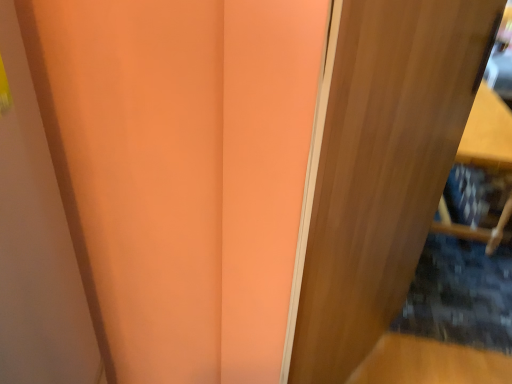
I want to click on wooden shelf at right, so click(x=487, y=131).

Describe the element at coordinates (487, 131) in the screenshot. I see `wooden shelf at right` at that location.

Measure the distance between wooden shelf at right and camera.

6.02 feet.

Describe the element at coordinates (387, 190) in the screenshot. Image resolution: width=512 pixels, height=384 pixels. I see `wooden door at right` at that location.

The image size is (512, 384). In order to click on wooden door at right in this screenshot , I will do `click(387, 190)`.

Identify the location of wooden shelf at right. This screenshot has height=384, width=512. (487, 131).

Is wooden shelf at right to the left or to the right of wooden door at right in the image?

In the image, wooden shelf at right appears on the right side of wooden door at right.

Is wooden shelf at right positioned before wooden door at right?

No, wooden shelf at right is behind wooden door at right.

Which point is more forward, (466, 236) or (401, 111)?

The point (401, 111) is more forward.

From the image's perspective, is wooden shelf at right above or below wooden door at right?

Based on their image positions, wooden shelf at right is located above wooden door at right.

From a real-world perspective, which is physically below, wooden shelf at right or wooden door at right?

In real-world perspective, wooden shelf at right is lower.

Between wooden shelf at right and wooden door at right, which one has larger width?

wooden shelf at right is wider.

Can you confirm if wooden shelf at right is taller than wooden door at right?

No, wooden shelf at right is not taller than wooden door at right.

Considering the relative sizes of wooden shelf at right and wooden door at right in the image provided, is wooden shelf at right bigger than wooden door at right?

Yes.

Is wooden shelf at right positioned beyond the bounds of wooden door at right?

Yes, wooden shelf at right is outside of wooden door at right.

Are wooden shelf at right and wooden door at right located far from each other?

That's not correct — wooden shelf at right is a little close to wooden door at right.

Looking at this image, is wooden shelf at right facing away from wooden door at right?

wooden shelf at right is not turned away from wooden door at right.

You are a GUI agent. You are given a task and a screenshot of the screen. Output one action in this format:
    pyautogui.click(x=<x>, y=<y>)
    Task: Click on the door above the wooden shelf at right (from a real-world perspective)
    
    Given the screenshot: What is the action you would take?
    pyautogui.click(x=387, y=190)

Between wooden door at right and wooden shelf at right, which one appears on the left side from the viewer's perspective?

Positioned to the left is wooden door at right.

Is wooden door at right in front of or behind wooden shelf at right in the image?

Clearly, wooden door at right is in front of wooden shelf at right.

Considering the points (332, 236) and (493, 148), which point is behind, point (332, 236) or point (493, 148)?

The point (493, 148) is farther.

Based on the photo, from the image's perspective, would you say wooden door at right is positioned over wooden shelf at right?

Incorrect, from the image's perspective, wooden door at right is lower than wooden shelf at right.

From a real-world perspective, does wooden door at right stand above wooden shelf at right?

Indeed, from a real-world perspective, wooden door at right stands above wooden shelf at right.

Between wooden door at right and wooden shelf at right, which one has larger width?

With larger width is wooden shelf at right.

Does wooden door at right have a lesser height compared to wooden shelf at right?

In fact, wooden door at right may be taller than wooden shelf at right.

Which of these two, wooden door at right or wooden shelf at right, is smaller?

Smaller between the two is wooden door at right.

Is wooden door at right surrounding wooden shelf at right?

No, wooden shelf at right is not inside wooden door at right.

Is wooden door at right directly adjacent to wooden shelf at right?

No, wooden door at right is not making contact with wooden shelf at right.

Is wooden door at right aimed at wooden shelf at right?

No, wooden door at right is not oriented towards wooden shelf at right.

How many degrees apart are the facing directions of wooden door at right and wooden shelf at right?

The angle between the facing direction of wooden door at right and the facing direction of wooden shelf at right is 19.6 degrees.

The height and width of the screenshot is (384, 512). Find the location of `door above the wooden shelf at right (from a real-world perspective)`. door above the wooden shelf at right (from a real-world perspective) is located at coordinates (387, 190).

Identify the location of furniture behind the wooden door at right. The height and width of the screenshot is (384, 512). (487, 131).

The width and height of the screenshot is (512, 384). I want to click on door above the wooden shelf at right (from a real-world perspective), so click(x=387, y=190).